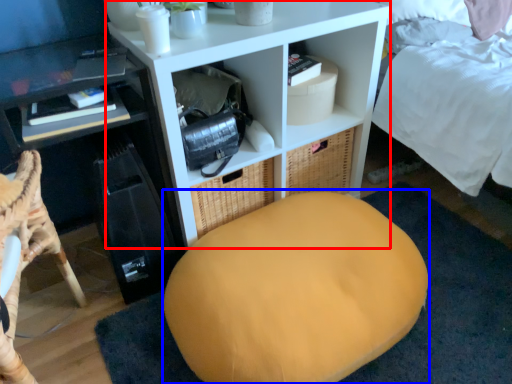
Question: Which object is closer to the camera taking this photo, shelf (highlighted by a red box) or bean bag chair (highlighted by a blue box)?

Choices:
 (A) shelf
 (B) bean bag chair

Answer: (B)